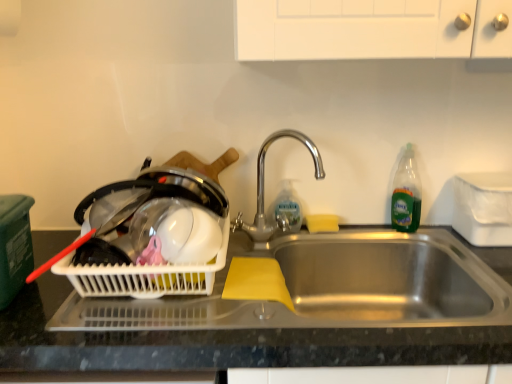
Question: Does white plastic container at right have a greater width compared to stainless steel sink at center?

Choices:
 (A) yes
 (B) no

Answer: (B)

Question: Is white plastic container at right looking in the opposite direction of stainless steel sink at center?

Choices:
 (A) no
 (B) yes

Answer: (A)

Question: From a real-world perspective, is white plastic container at right below stainless steel sink at center?

Choices:
 (A) no
 (B) yes

Answer: (A)

Question: Does white plastic container at right have a larger size compared to stainless steel sink at center?

Choices:
 (A) yes
 (B) no

Answer: (B)

Question: Is white plastic container at right facing towards stainless steel sink at center?

Choices:
 (A) yes
 (B) no

Answer: (B)

Question: From a real-world perspective, is white plastic container at right over stainless steel sink at center?

Choices:
 (A) no
 (B) yes

Answer: (B)

Question: Is there a large distance between white plastic container at right and yellow sponge at sink?

Choices:
 (A) no
 (B) yes

Answer: (A)

Question: Considering the relative positions of white plastic container at right and yellow sponge at sink in the image provided, is white plastic container at right in front of yellow sponge at sink?

Choices:
 (A) no
 (B) yes

Answer: (B)

Question: Is white plastic container at right thinner than yellow sponge at sink?

Choices:
 (A) yes
 (B) no

Answer: (B)

Question: Would you say white plastic container at right is outside yellow sponge at sink?

Choices:
 (A) no
 (B) yes

Answer: (B)

Question: Considering the relative sizes of white plastic container at right and yellow sponge at sink in the image provided, is white plastic container at right bigger than yellow sponge at sink?

Choices:
 (A) yes
 (B) no

Answer: (A)

Question: Is white plastic container at right touching yellow sponge at sink?

Choices:
 (A) yes
 (B) no

Answer: (B)

Question: Does stainless steel sink at center have a lesser width compared to white plastic container at right?

Choices:
 (A) no
 (B) yes

Answer: (A)